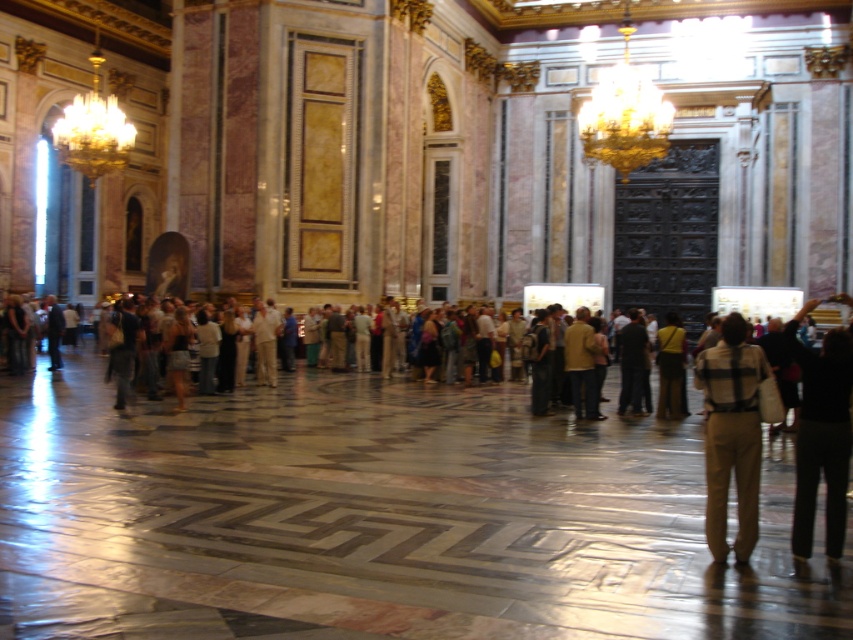
Between point (802, 376) and point (665, 356), which one is positioned behind?

Point (665, 356)

Who is positioned more to the right, black cotton pants at lower right or brown leather backpack at center?

Positioned to the right is black cotton pants at lower right.

At what (x,y) coordinates should I click in order to perform the action: click on black cotton pants at lower right. Please return your answer as a coordinate pair (x, y). The height and width of the screenshot is (640, 853). Looking at the image, I should click on (821, 435).

Can you confirm if khaki cotton pants at center is bigger than black cotton pants at lower right?

Actually, khaki cotton pants at center might be smaller than black cotton pants at lower right.

Image resolution: width=853 pixels, height=640 pixels. I want to click on khaki cotton pants at center, so [x=730, y=435].

Which is behind, point (711, 444) or point (840, 292)?

The point (840, 292) is behind.

Identify the location of khaki cotton pants at center. Image resolution: width=853 pixels, height=640 pixels. (730, 435).

Does khaki cotton pants at center lie in front of brown leather backpack at center?

That is True.

Does khaki cotton pants at center have a smaller size compared to brown leather backpack at center?

No, khaki cotton pants at center is not smaller than brown leather backpack at center.

Image resolution: width=853 pixels, height=640 pixels. Describe the element at coordinates (730, 435) in the screenshot. I see `khaki cotton pants at center` at that location.

Locate an element on the screen. This screenshot has height=640, width=853. khaki cotton pants at center is located at coordinates (730, 435).